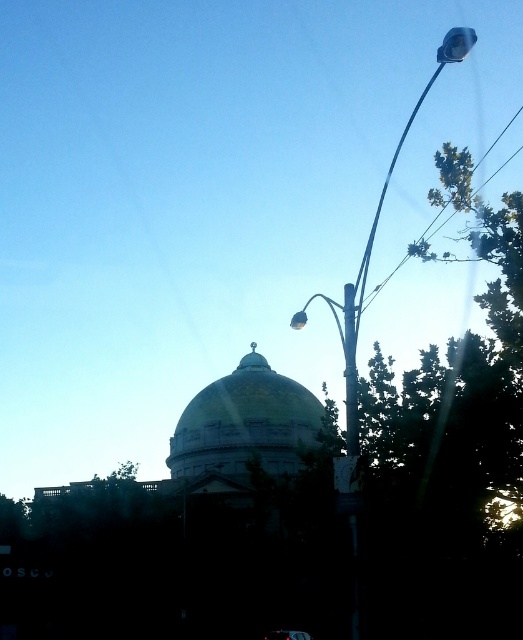
Question: Which point is farther to the camera?

Choices:
 (A) gold/yellow dome at center
 (B) metallic pole at right
 (C) metallic silver street light at upper right

Answer: (A)

Question: Observing the image, what is the correct spatial positioning of gold/yellow dome at center in reference to shiny black car at center?

Choices:
 (A) above
 (B) below

Answer: (A)

Question: Based on their relative distances, which object is farther from the metallic silver street light at upper right?

Choices:
 (A) metallic pole at right
 (B) gold/yellow dome at center

Answer: (B)

Question: Which point is farther from the camera taking this photo?

Choices:
 (A) coord(356,342)
 (B) coord(274,632)

Answer: (B)

Question: Considering the relative positions of metallic silver street light at upper right and metallic pole at right in the image provided, where is metallic silver street light at upper right located with respect to metallic pole at right?

Choices:
 (A) left
 (B) right

Answer: (B)

Question: Does metallic silver street light at upper right appear over metallic pole at right?

Choices:
 (A) no
 (B) yes

Answer: (B)